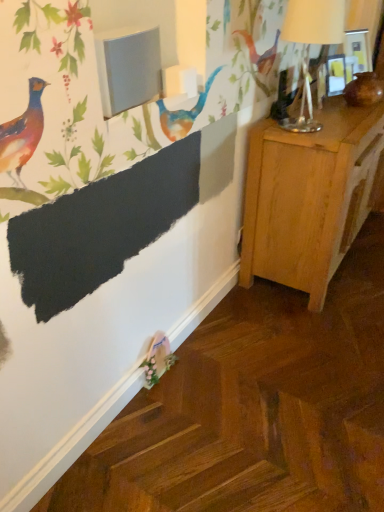
Question: In terms of height, does light wood nightstand at right look taller or shorter compared to metallic silver table lamp at upper right?

Choices:
 (A) short
 (B) tall

Answer: (B)

Question: Is light wood nightstand at right in front of or behind metallic silver table lamp at upper right in the image?

Choices:
 (A) front
 (B) behind

Answer: (B)

Question: From the image's perspective, is light wood nightstand at right located above or below metallic silver table lamp at upper right?

Choices:
 (A) below
 (B) above

Answer: (A)

Question: From a real-world perspective, is metallic silver table lamp at upper right above or below light wood nightstand at right?

Choices:
 (A) below
 (B) above

Answer: (B)

Question: Is metallic silver table lamp at upper right inside or outside of light wood nightstand at right?

Choices:
 (A) inside
 (B) outside

Answer: (B)

Question: Does point pyautogui.click(x=327, y=18) appear closer or farther from the camera than point pyautogui.click(x=314, y=269)?

Choices:
 (A) closer
 (B) farther

Answer: (A)

Question: Looking at the image, does metallic silver table lamp at upper right seem bigger or smaller compared to light wood nightstand at right?

Choices:
 (A) small
 (B) big

Answer: (A)